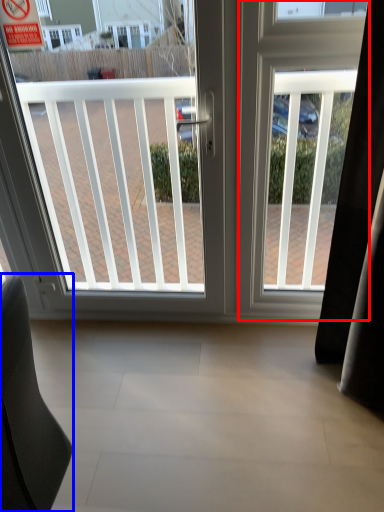
Question: Which point is further to the camera, screen door (highlighted by a red box) or furniture (highlighted by a blue box)?

Choices:
 (A) screen door
 (B) furniture

Answer: (A)